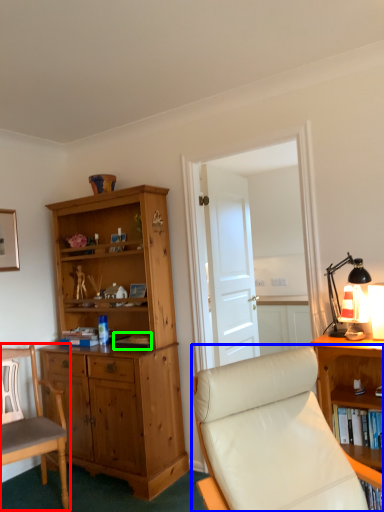
Question: Which is nearer to the chair (highlighted by a red box)? chair (highlighted by a blue box) or book (highlighted by a green box).

Choices:
 (A) chair
 (B) book

Answer: (B)